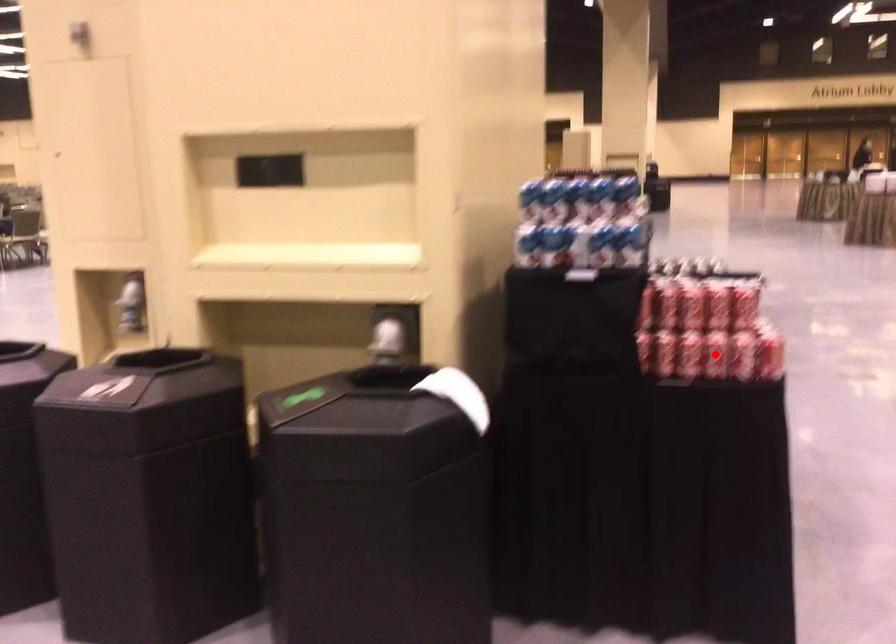
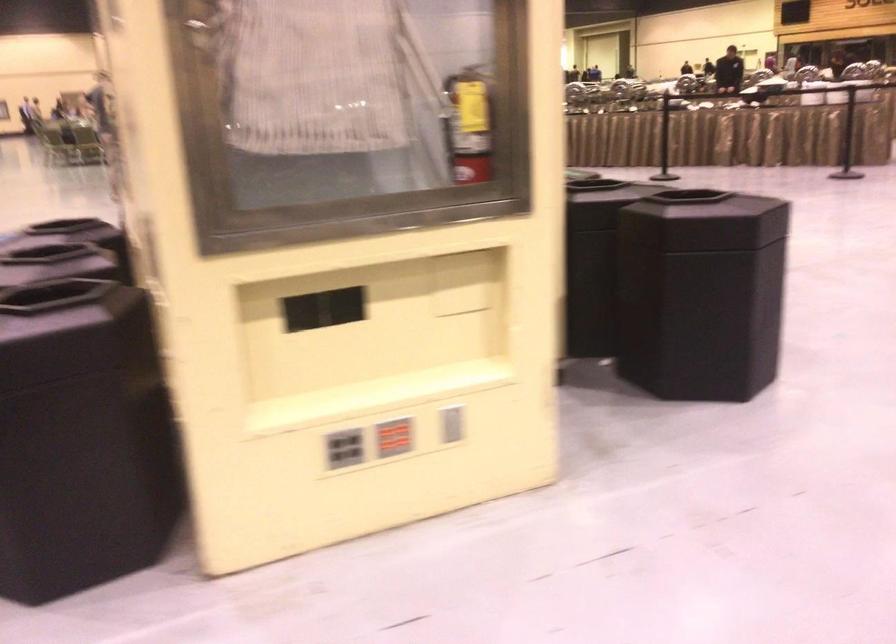
Question: I am providing you with two images of the same scene from different viewpoints. A red point is marked on the first image. Can you still see the location of the red point in image 2?

Choices:
 (A) Yes
 (B) No

Answer: (B)